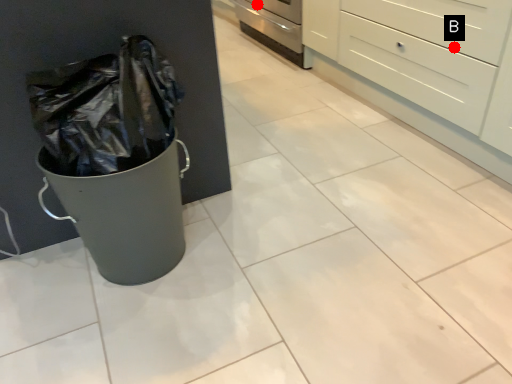
Question: Two points are circled on the image, labeled by A and B beside each circle. Which point is closer to the camera?

Choices:
 (A) A is closer
 (B) B is closer

Answer: (B)